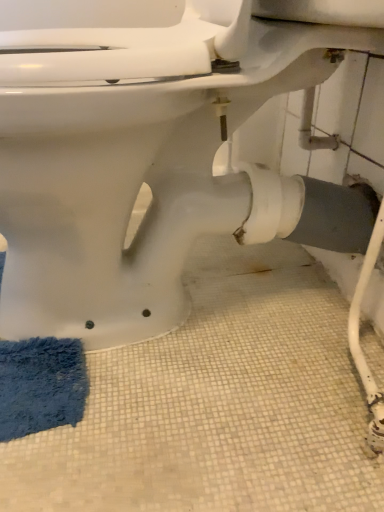
Question: Can you confirm if blue fuzzy bath mat at lower left is thinner than white glossy toilet at center?

Choices:
 (A) no
 (B) yes

Answer: (B)

Question: From a real-world perspective, is blue fuzzy bath mat at lower left under white glossy toilet at center?

Choices:
 (A) yes
 (B) no

Answer: (A)

Question: Does blue fuzzy bath mat at lower left turn towards white glossy toilet at center?

Choices:
 (A) no
 (B) yes

Answer: (A)

Question: Is blue fuzzy bath mat at lower left not inside white glossy toilet at center?

Choices:
 (A) yes
 (B) no

Answer: (B)

Question: Is blue fuzzy bath mat at lower left facing away from white glossy toilet at center?

Choices:
 (A) yes
 (B) no

Answer: (B)

Question: Can white glossy toilet at center be found inside blue fuzzy bath mat at lower left?

Choices:
 (A) no
 (B) yes

Answer: (A)

Question: Can you confirm if white glossy toilet at center is shorter than blue fuzzy bath mat at lower left?

Choices:
 (A) yes
 (B) no

Answer: (B)

Question: From the image's perspective, is white glossy toilet at center on blue fuzzy bath mat at lower left?

Choices:
 (A) no
 (B) yes

Answer: (B)

Question: From a real-world perspective, is white glossy toilet at center over blue fuzzy bath mat at lower left?

Choices:
 (A) yes
 (B) no

Answer: (A)

Question: Considering the relative sizes of white glossy toilet at center and blue fuzzy bath mat at lower left in the image provided, is white glossy toilet at center taller than blue fuzzy bath mat at lower left?

Choices:
 (A) yes
 (B) no

Answer: (A)

Question: Considering the relative positions of white glossy toilet at center and blue fuzzy bath mat at lower left in the image provided, is white glossy toilet at center behind blue fuzzy bath mat at lower left?

Choices:
 (A) no
 (B) yes

Answer: (A)

Question: Is white glossy toilet at center positioned far away from blue fuzzy bath mat at lower left?

Choices:
 (A) yes
 (B) no

Answer: (B)

Question: Considering the positions of white glossy toilet at center and blue fuzzy bath mat at lower left in the image, is white glossy toilet at center bigger or smaller than blue fuzzy bath mat at lower left?

Choices:
 (A) small
 (B) big

Answer: (B)